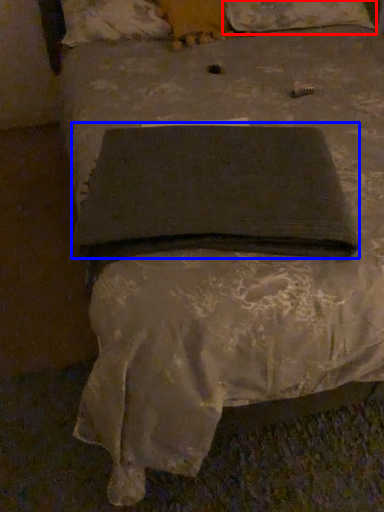
Question: Which point is further to the camera, pillow (highlighted by a red box) or pad (highlighted by a blue box)?

Choices:
 (A) pillow
 (B) pad

Answer: (A)